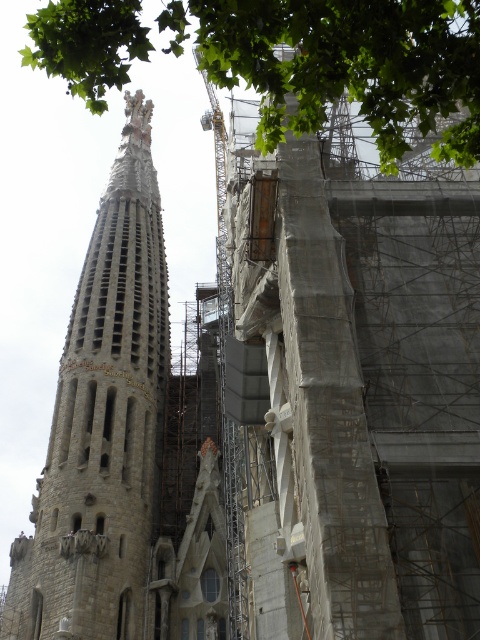
Question: Which point is closer to the camera?

Choices:
 (A) stone tower at left
 (B) green leafy tree at upper center

Answer: (B)

Question: Is stone tower at left wider than green leafy tree at upper center?

Choices:
 (A) no
 (B) yes

Answer: (A)

Question: Which of the following is the farthest from the observer?

Choices:
 (A) stone tower at left
 (B) green leafy tree at upper center

Answer: (A)

Question: Can you confirm if stone tower at left is smaller than green leafy tree at upper center?

Choices:
 (A) yes
 (B) no

Answer: (A)

Question: Does stone tower at left have a greater width compared to green leafy tree at upper center?

Choices:
 (A) yes
 (B) no

Answer: (B)